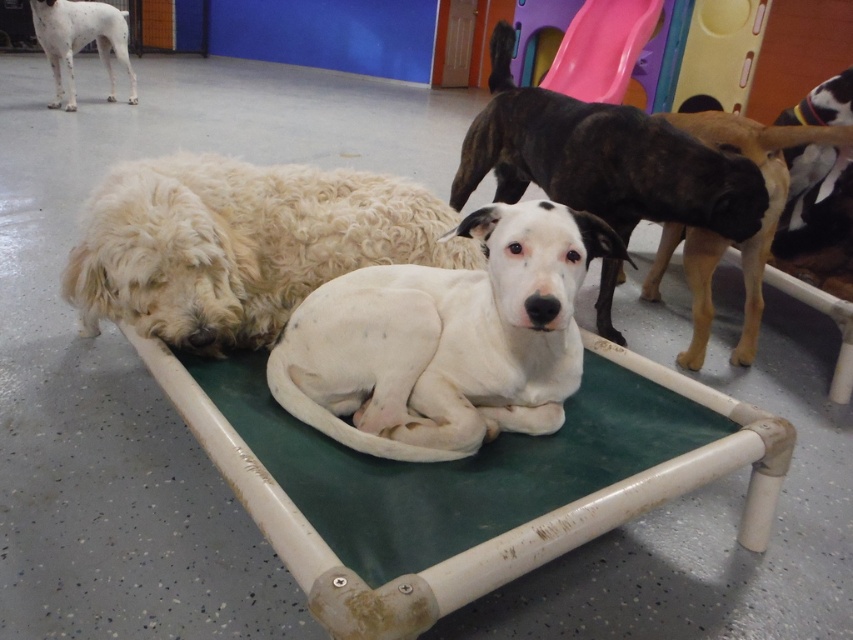
You are a dog owner who wants to place a new toy between the white fluffy dog at center and the brindle fur dog at center. Based on their positions, where should you place the toy so it is accessible to both dogs without being blocked by either?

The white fluffy dog at center is positioned under the brindle fur dog at center, so placing the toy between them would require positioning it in a spot that is not obstructed by either dog. Since the white fluffy dog is under the brindle one, the toy should be placed in a location that is above or to the side of both dogs to ensure accessibility.

You are a new dog owner visiting the daycare and want to place your small dog on the green fabric dog bed at center. However, there is a taller white speckled fur at upper left nearby. Do you think your dog can safely get onto the bed without jumping too high?

The green fabric dog bed at center is shorter than the white speckled fur at upper left. Since the bed is lower, your small dog should be able to step onto it easily without needing to jump too high.